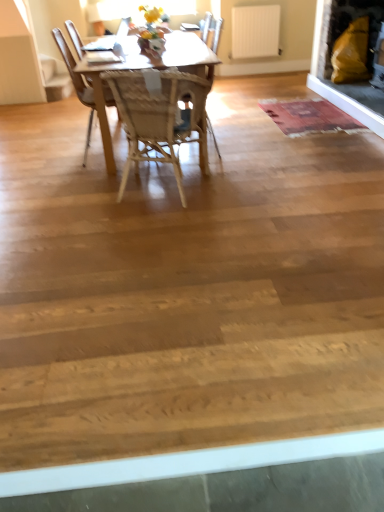
Question: From the image's perspective, is wooden chair at center, marked as the second chair in a front-to-back arrangement, located above rustic woolen mat at center?

Choices:
 (A) no
 (B) yes

Answer: (A)

Question: Does wooden chair at center, the 1th chair viewed from the back, have a larger size compared to rustic woolen mat at center?

Choices:
 (A) yes
 (B) no

Answer: (A)

Question: Is wooden chair at center, marked as the second chair in a front-to-back arrangement, further to camera compared to rustic woolen mat at center?

Choices:
 (A) yes
 (B) no

Answer: (B)

Question: Is wooden chair at center, the 1th chair viewed from the back, smaller than rustic woolen mat at center?

Choices:
 (A) no
 (B) yes

Answer: (A)

Question: Considering the relative sizes of wooden chair at center, the 1th chair viewed from the back, and rustic woolen mat at center in the image provided, is wooden chair at center, the 1th chair viewed from the back, wider than rustic woolen mat at center?

Choices:
 (A) yes
 (B) no

Answer: (B)

Question: Based on their sizes in the image, would you say wooden chair at center, marked as the second chair in a front-to-back arrangement, is bigger or smaller than matte yellow cushion at upper right?

Choices:
 (A) big
 (B) small

Answer: (B)

Question: Does point (215, 42) appear closer or farther from the camera than point (377, 14)?

Choices:
 (A) closer
 (B) farther

Answer: (B)

Question: From the image's perspective, is wooden chair at center, the 1th chair viewed from the back, above or below matte yellow cushion at upper right?

Choices:
 (A) below
 (B) above

Answer: (A)

Question: Considering their positions, is wooden chair at center, marked as the second chair in a front-to-back arrangement, located in front of or behind matte yellow cushion at upper right?

Choices:
 (A) front
 (B) behind

Answer: (A)

Question: Considering the positions of woven wood chair at center, which is the first chair from front to back, and white matte radiator at upper center in the image, is woven wood chair at center, which is the first chair from front to back, wider or thinner than white matte radiator at upper center?

Choices:
 (A) thin
 (B) wide

Answer: (B)

Question: Is woven wood chair at center, which is the first chair from front to back, bigger or smaller than white matte radiator at upper center?

Choices:
 (A) big
 (B) small

Answer: (A)

Question: Considering their positions, is woven wood chair at center, the 2th chair when ordered from back to front, located in front of or behind white matte radiator at upper center?

Choices:
 (A) behind
 (B) front

Answer: (B)

Question: Is point (203, 108) positioned closer to the camera than point (253, 33)?

Choices:
 (A) closer
 (B) farther

Answer: (A)

Question: From their relative heights in the image, would you say white matte radiator at upper center is taller or shorter than rustic woolen mat at center?

Choices:
 (A) short
 (B) tall

Answer: (B)

Question: Considering the positions of white matte radiator at upper center and rustic woolen mat at center in the image, is white matte radiator at upper center bigger or smaller than rustic woolen mat at center?

Choices:
 (A) big
 (B) small

Answer: (B)